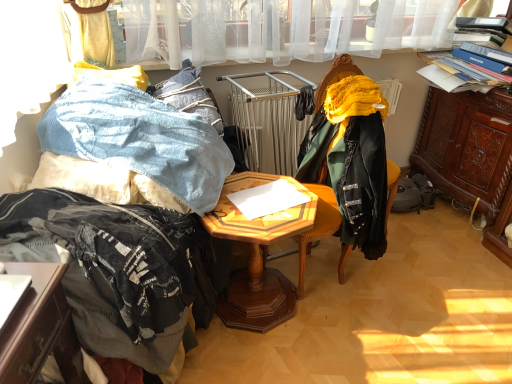
Question: From the image's perspective, is fuzzy black blanket at left above or below velvet green chair at center?

Choices:
 (A) above
 (B) below

Answer: (B)

Question: Looking at the image, does fuzzy black blanket at left seem bigger or smaller compared to velvet green chair at center?

Choices:
 (A) big
 (B) small

Answer: (A)

Question: Considering the real-world distances, which object is farthest from the woodenobject at center?

Choices:
 (A) velvet green chair at center
 (B) brown carved wood cabinet at right
 (C) fuzzy black blanket at left
 (D) denim fabric at left

Answer: (B)

Question: Estimate the real-world distances between objects in this image. Which object is closer to the velvet green chair at center?

Choices:
 (A) fuzzy black blanket at left
 (B) brown carved wood cabinet at right
 (C) woodenobject at center
 (D) denim fabric at left

Answer: (C)